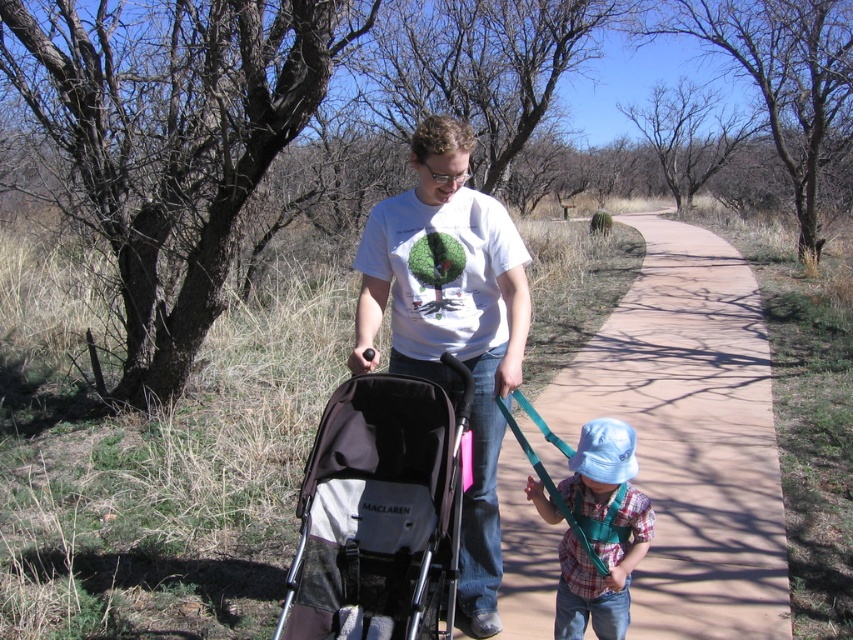
You are a parent walking with your child in a desert area. You need to move to the left side of the dark gray fabric stroller at center to avoid the cacti on the right. Is the paved concrete path at center available for you to move to the left?

The paved concrete path at center is positioned on the right side of the dark gray fabric stroller at center, so moving to the left would take you away from the path. Therefore, the path is not available for moving left to avoid the cacti.

Looking at this image, you are standing at the point marked by coordinates point (x=691, y=435). Looking around, you see a paved path and some cacti nearby. Which direction should you walk to stay on the paved path?

The point (x=691, y=435) is on the paved concrete path at center, so walking forward along the path will keep you on it.